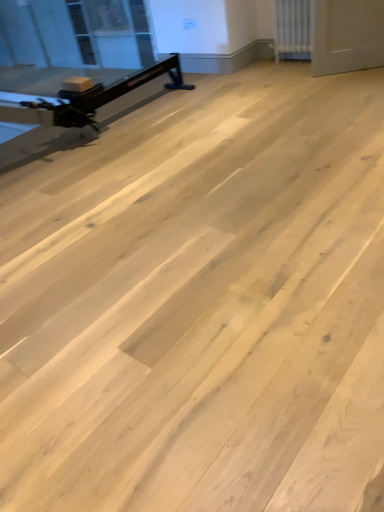
Question: Relative to white textured radiator at upper right, is transparent glass window screen at upper left in front or behind?

Choices:
 (A) behind
 (B) front

Answer: (A)

Question: From the image's perspective, relative to white textured radiator at upper right, is transparent glass window screen at upper left above or below?

Choices:
 (A) below
 (B) above

Answer: (B)

Question: Which is nearer to the matte black exercise bike at left?

Choices:
 (A) white textured radiator at upper right
 (B) transparent glass window screen at upper left

Answer: (A)

Question: Estimate the real-world distances between objects in this image. Which object is farther from the white textured radiator at upper right?

Choices:
 (A) transparent glass window screen at upper left
 (B) matte black exercise bike at left

Answer: (A)